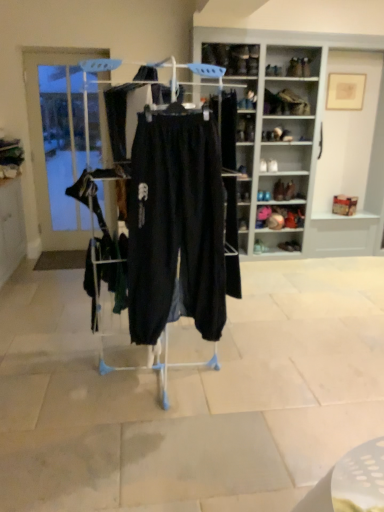
Question: Is matte black shoe at center, which appears as the 2th shelf when viewed from the right, located outside clear glass door at left?

Choices:
 (A) no
 (B) yes

Answer: (B)

Question: Considering the relative sizes of matte black shoe at center, which appears as the 2th shelf when viewed from the right, and clear glass door at left in the image provided, is matte black shoe at center, which appears as the 2th shelf when viewed from the right, shorter than clear glass door at left?

Choices:
 (A) yes
 (B) no

Answer: (A)

Question: From a real-world perspective, is matte black shoe at center, which appears as the 2th shelf when viewed from the right, positioned under clear glass door at left based on gravity?

Choices:
 (A) no
 (B) yes

Answer: (B)

Question: Is matte black shoe at center, which ranks as the 1th shelf in left-to-right order, taller than clear glass door at left?

Choices:
 (A) yes
 (B) no

Answer: (B)

Question: Is matte black shoe at center, which appears as the first shelf when ordered from the bottom, beside clear glass door at left?

Choices:
 (A) yes
 (B) no

Answer: (B)

Question: Can you confirm if matte black shoe at center, which ranks as the second shelf in top-to-bottom order, is bigger than clear glass door at left?

Choices:
 (A) yes
 (B) no

Answer: (B)

Question: Can we say matte black shoe at center, which ranks as the 1th shelf in left-to-right order, lies outside white wood shelves at upper right, the 2th shelf positioned from the bottom?

Choices:
 (A) yes
 (B) no

Answer: (B)

Question: From the image's perspective, is matte black shoe at center, which appears as the 2th shelf when viewed from the right, under white wood shelves at upper right, positioned as the first shelf in top-to-bottom order?

Choices:
 (A) no
 (B) yes

Answer: (B)

Question: Is matte black shoe at center, which appears as the 2th shelf when viewed from the right, not close to white wood shelves at upper right, positioned as the first shelf in top-to-bottom order?

Choices:
 (A) no
 (B) yes

Answer: (A)

Question: Is matte black shoe at center, which appears as the 2th shelf when viewed from the right, facing away from white wood shelves at upper right, positioned as the first shelf in top-to-bottom order?

Choices:
 (A) no
 (B) yes

Answer: (B)

Question: From a real-world perspective, is matte black shoe at center, which appears as the 2th shelf when viewed from the right, under white wood shelves at upper right, the 2th shelf positioned from the bottom?

Choices:
 (A) no
 (B) yes

Answer: (B)

Question: Is matte black shoe at center, which ranks as the second shelf in top-to-bottom order, positioned in front of white wood shelves at upper right, the 2th shelf positioned from the bottom?

Choices:
 (A) yes
 (B) no

Answer: (B)

Question: Considering the relative sizes of matte black shoe at center, marked as the 4th footwear in a bottom-to-top arrangement, and clear glass door at left in the image provided, is matte black shoe at center, marked as the 4th footwear in a bottom-to-top arrangement, smaller than clear glass door at left?

Choices:
 (A) yes
 (B) no

Answer: (A)